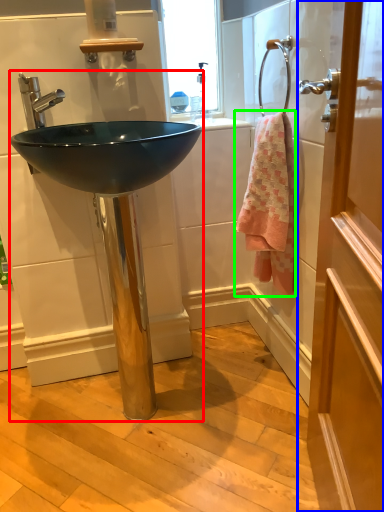
Question: Estimate the real-world distances between objects in this image. Which object is closer to sink (highlighted by a red box), door (highlighted by a blue box) or towel/napkin (highlighted by a green box)?

Choices:
 (A) door
 (B) towel/napkin

Answer: (B)